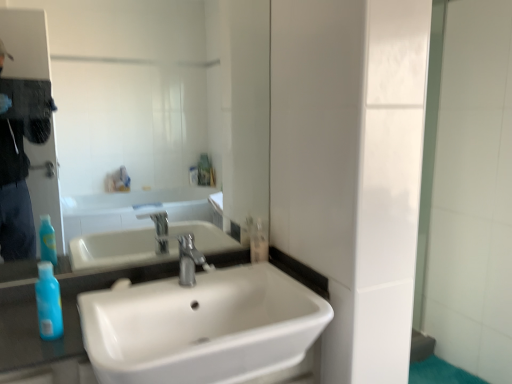
Identify the location of free location in front of clear plastic bottle at center, which is the 1th mouthwash from back to front. (252, 271).